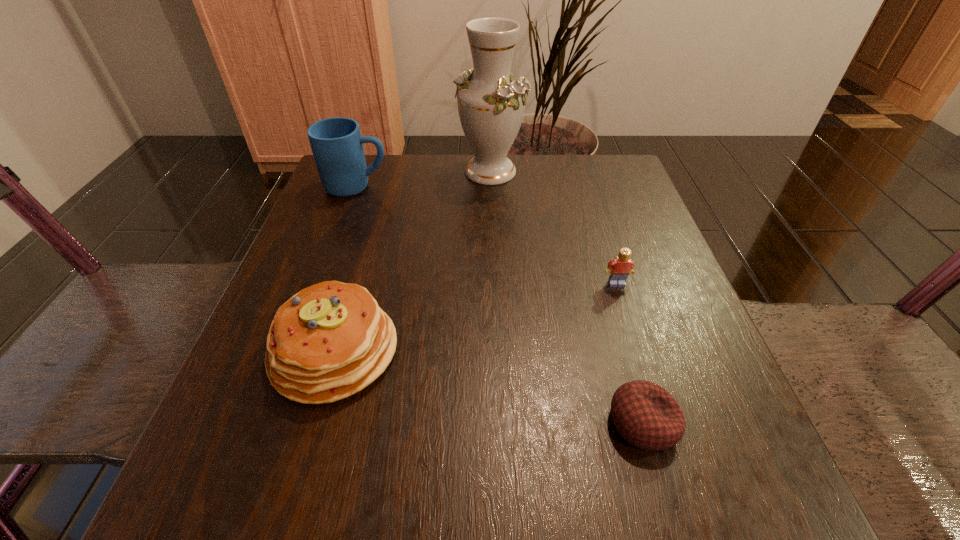
The image size is (960, 540). I want to click on free space that satisfies the following two spatial constraints: 1. on the side of the beanbag with the handle; 2. on the right side of the second tallest object, so click(x=271, y=422).

Identify the location of vacant region that satisfies the following two spatial constraints: 1. on the front side of the beanbag; 2. on the right side of the tallest object. pyautogui.click(x=498, y=422).

Locate an element on the screen. This screenshot has width=960, height=540. vacant space that satisfies the following two spatial constraints: 1. on the side of the pancake with the handle; 2. on the left side of the mug is located at coordinates click(x=297, y=351).